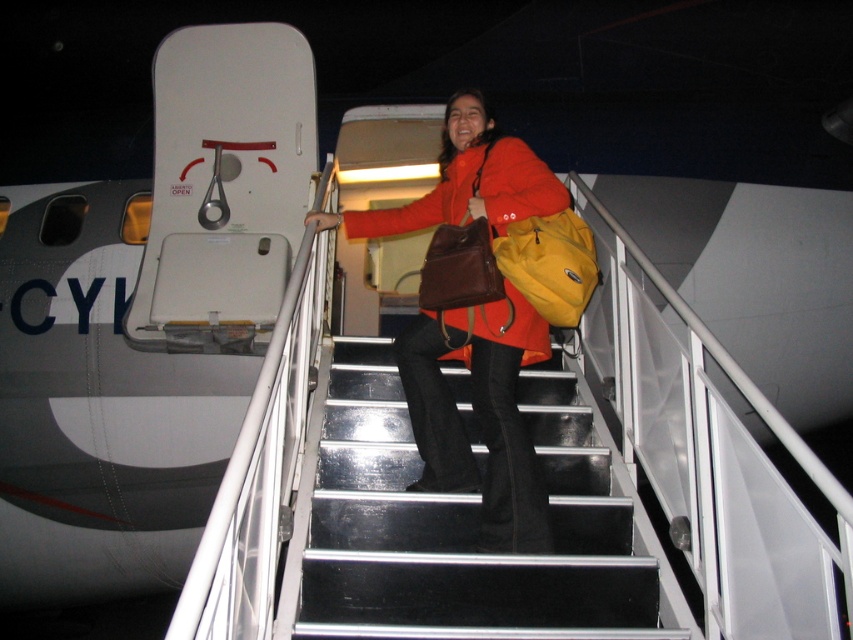
You are a flight attendant observing the scene. You need to ensure that the matte orange jacket at center and the leather brown bag at center are properly secured before takeoff. Which object is taller and needs to be stowed first to avoid blocking the aisle?

The matte orange jacket at center is much taller than the leather brown bag at center, so it should be stowed first to avoid blocking the aisle.

You are a flight attendant on an aircraft with an open hatch. You need to hand over a document to a passenger wearing a matte orange jacket at center and a passenger carrying a yellow fabric backpack at center. Which passenger should you approach first if you want to give the document to the one closer to the aircraft door?

The matte orange jacket at center is to the left of the yellow fabric backpack at center. Since the passenger with the matte orange jacket at center is closer to the aircraft door, you should approach them first.